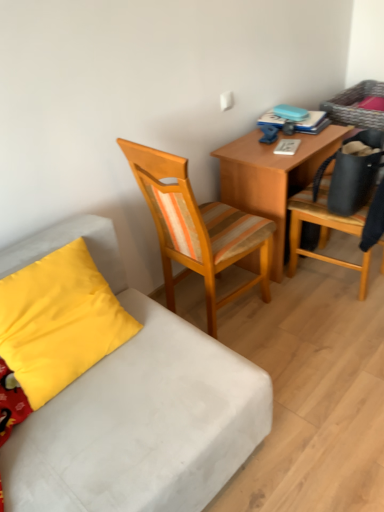
In order to click on vacant space that is in between woodenchair at center, the first chair positioned from the left, and wooden chair at right, the second chair viewed from the left in this screenshot , I will do click(302, 316).